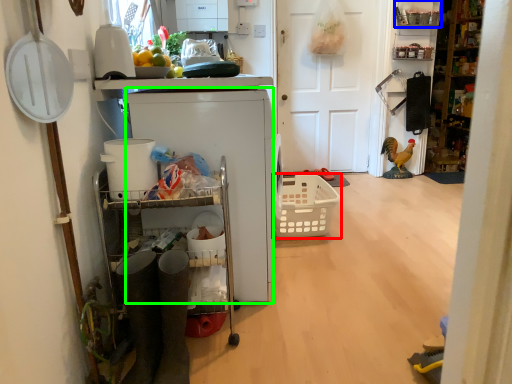
Question: Which is farther away from basket (highlighted by a red box)? shelf (highlighted by a blue box) or appliance (highlighted by a green box)?

Choices:
 (A) shelf
 (B) appliance

Answer: (A)